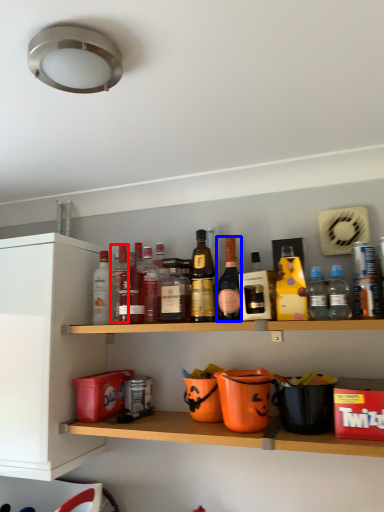
Question: Among these objects, which one is farthest to the camera, bottle (highlighted by a red box) or bottle (highlighted by a blue box)?

Choices:
 (A) bottle
 (B) bottle

Answer: (A)